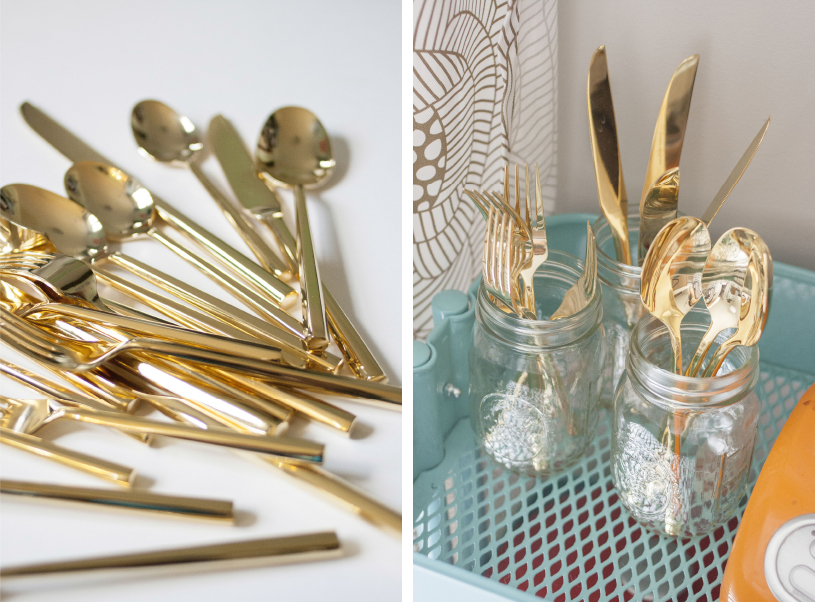
Identify the location of plastic bin. The height and width of the screenshot is (603, 815). click(x=451, y=358), click(x=529, y=534).